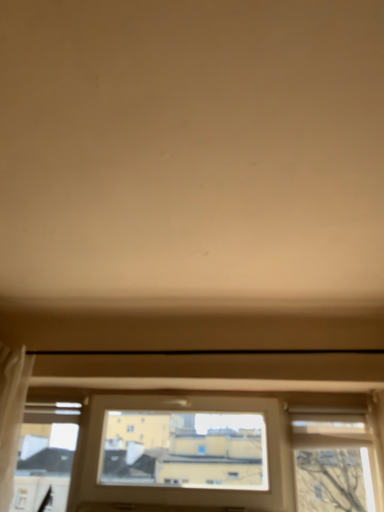
Question: Can you confirm if transparent glass window at bottom is smaller than white sheer curtain at left?

Choices:
 (A) no
 (B) yes

Answer: (A)

Question: Is transparent glass window at bottom at the left side of white sheer curtain at left?

Choices:
 (A) yes
 (B) no

Answer: (B)

Question: Is transparent glass window at bottom facing towards white sheer curtain at left?

Choices:
 (A) no
 (B) yes

Answer: (B)

Question: From a real-world perspective, is transparent glass window at bottom beneath white sheer curtain at left?

Choices:
 (A) yes
 (B) no

Answer: (A)

Question: From the image's perspective, would you say transparent glass window at bottom is positioned over white sheer curtain at left?

Choices:
 (A) yes
 (B) no

Answer: (B)

Question: Is transparent glass window at bottom bigger than white sheer curtain at left?

Choices:
 (A) no
 (B) yes

Answer: (B)

Question: Does white sheer curtain at left come behind transparent glass window at bottom?

Choices:
 (A) no
 (B) yes

Answer: (A)

Question: From a real-world perspective, is white sheer curtain at left over transparent glass window at bottom?

Choices:
 (A) yes
 (B) no

Answer: (A)

Question: Is white sheer curtain at left not near transparent glass window at bottom?

Choices:
 (A) no
 (B) yes

Answer: (A)

Question: Is white sheer curtain at left facing towards transparent glass window at bottom?

Choices:
 (A) yes
 (B) no

Answer: (B)

Question: Can you confirm if white sheer curtain at left is thinner than transparent glass window at bottom?

Choices:
 (A) yes
 (B) no

Answer: (B)

Question: Can you confirm if white sheer curtain at left is bigger than transparent glass window at bottom?

Choices:
 (A) no
 (B) yes

Answer: (A)

Question: Based on their positions, is transparent glass window at bottom located to the left or right of white sheer curtain at left?

Choices:
 (A) right
 (B) left

Answer: (A)